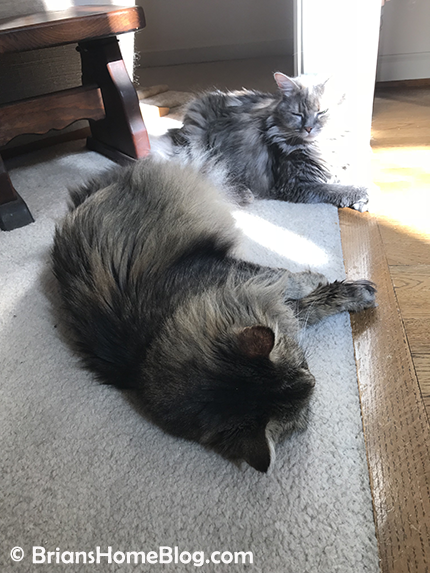
This screenshot has height=573, width=430. Find the location of `furniture`. furniture is located at coordinates (84, 120), (83, 38).